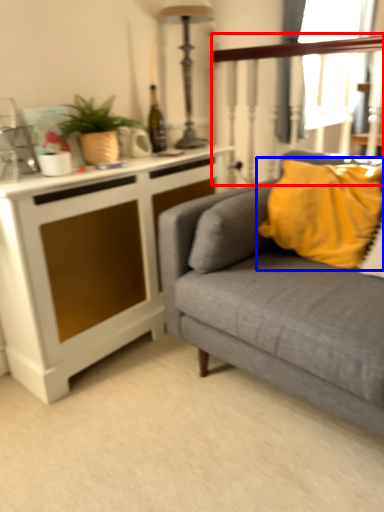
Question: Which object appears closest to the camera in this image, rail (highlighted by a red box) or pillow (highlighted by a blue box)?

Choices:
 (A) rail
 (B) pillow

Answer: (B)